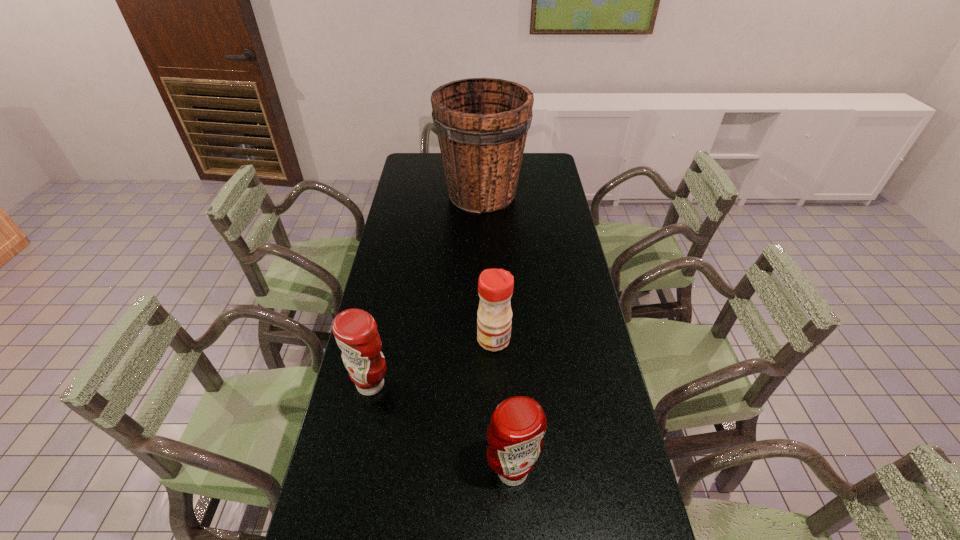
Locate an element on the screen. This screenshot has height=540, width=960. empty location between the leftmost condiment and the tallest object is located at coordinates (426, 289).

Point out which object is positioned as the nearest to the leftmost object. Please provide its 2D coordinates. Your answer should be formatted as a tuple, i.e. [(x, y)], where the tuple contains the x and y coordinates of a point satisfying the conditions above.

[(495, 286)]

Choose which object is the second nearest neighbor to the leftmost object. Please provide its 2D coordinates. Your answer should be formatted as a tuple, i.e. [(x, y)], where the tuple contains the x and y coordinates of a point satisfying the conditions above.

[(518, 424)]

Find the location of a particular element. This screenshot has width=960, height=540. condiment identified as the third closest to the tallest object is located at coordinates (518, 424).

This screenshot has height=540, width=960. Identify the location of the closest condiment to the farthest object. (495, 286).

Identify the location of vacant area that satisfies the following two spatial constraints: 1. on the back side of the farthest condiment; 2. on the left side of the leftmost condiment. (380, 340).